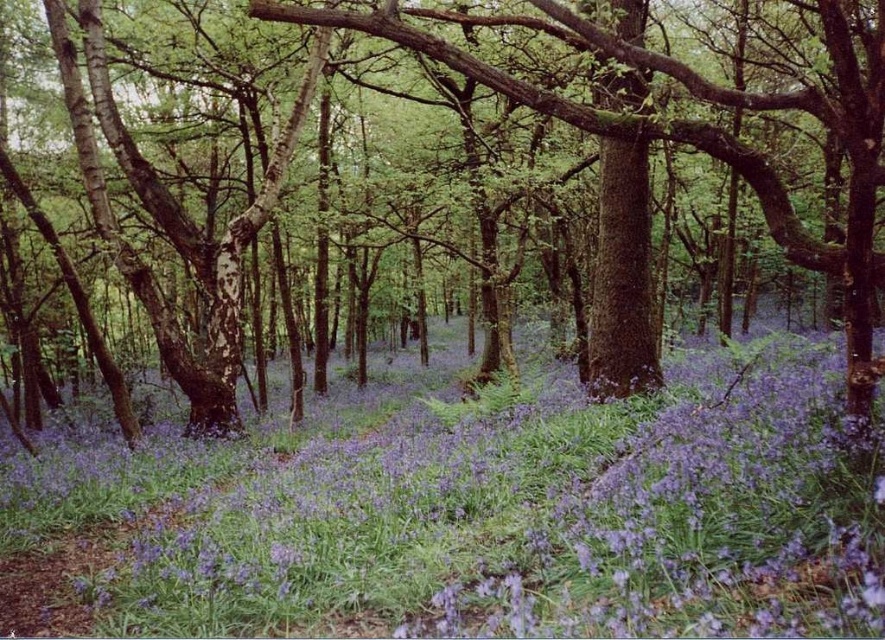
You are a nature photographer standing in the middle of a woodland scene. You want to capture a photo of the purple matte flower at center without any obstruction from the green matte tree at center. Is the flower visible from your current position?

The purple matte flower at center is positioned under the green matte tree at center, so it is obstructed by the tree and not visible from your current position.

You are standing in the woodland scene and want to pick the purple matte flower at center and the green matte tree at center. Which one can you reach without moving closer to the scene?

The purple matte flower at center is closer to the viewer than the green matte tree at center, so you can reach the purple matte flower at center without moving closer, but you would need to move closer to reach the green matte tree at center.

You are standing in the woodland scene and want to place two markers at the exact locations of point (43, 593) and point (213, 348). Which marker will you place first if you move from the foreground towards the background?

You will place the marker at point (43, 593) first because it is closer to the viewer than point (213, 348), which is further back in the scene.